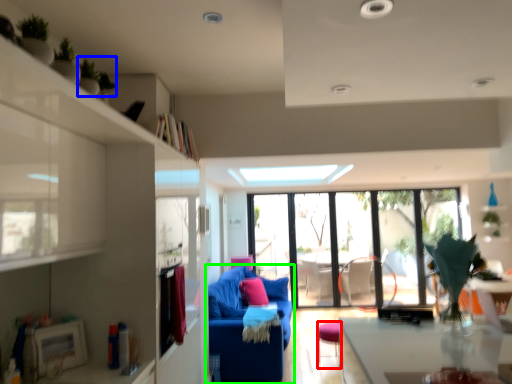
Question: Which object is the farthest from stool (highlighted by a red box)? Choose among these: plant (highlighted by a blue box) or studio couch (highlighted by a green box).

Choices:
 (A) plant
 (B) studio couch

Answer: (A)